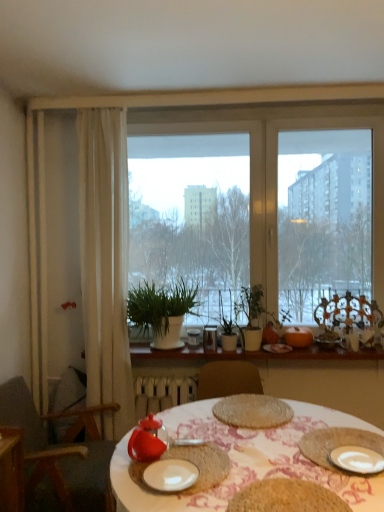
Where is `vacant space situated above matte red teapot at center, acting as the 1th tableware starting from the front (from a real-world perspective)`? The image size is (384, 512). vacant space situated above matte red teapot at center, acting as the 1th tableware starting from the front (from a real-world perspective) is located at coordinates (184, 463).